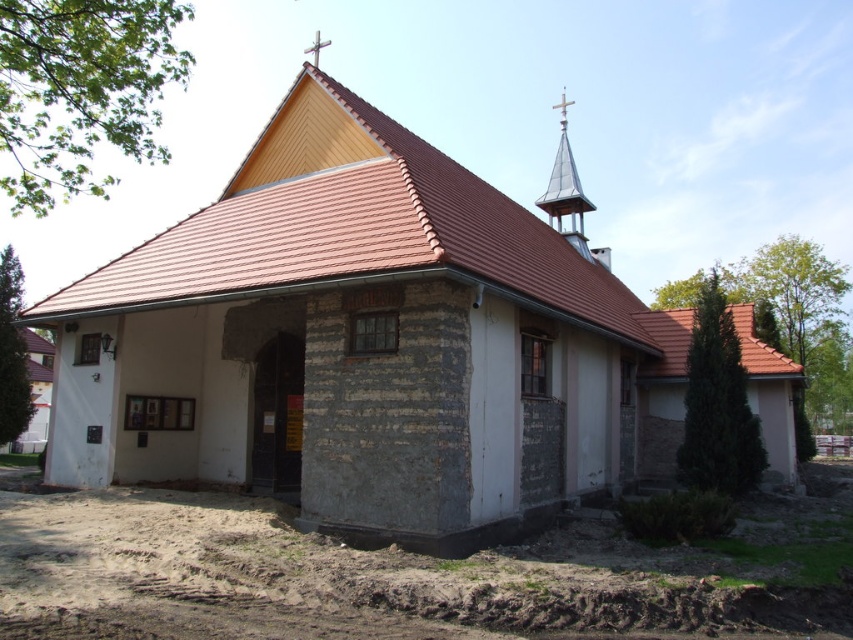
Between brown soil at lower left and shiny silver spire at upper right, which one appears on the left side from the viewer's perspective?

brown soil at lower left

Does brown soil at lower left appear on the left side of shiny silver spire at upper right?

Yes, brown soil at lower left is to the left of shiny silver spire at upper right.

Find the location of a particular element. This screenshot has width=853, height=640. brown soil at lower left is located at coordinates (404, 573).

Locate an element on the screen. brown soil at lower left is located at coordinates (404, 573).